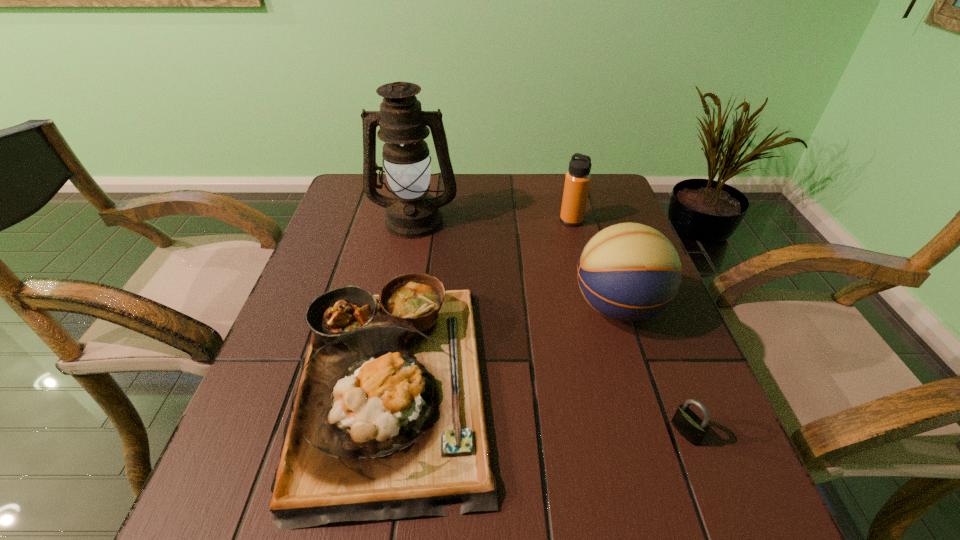
This screenshot has height=540, width=960. I want to click on blank area located on the right of the platter, so click(662, 382).

I want to click on free space located 0.270m on the back of the padlock, so click(638, 306).

I want to click on oil lamp that is at the far edge, so 412,213.

Locate an element on the screen. This screenshot has height=540, width=960. thermos bottle positioned at the far edge is located at coordinates (577, 181).

You are a GUI agent. You are given a task and a screenshot of the screen. Output one action in this format:
    pyautogui.click(x=<x>, y=<y>)
    Task: Click on the object at the near edge
    
    Given the screenshot: What is the action you would take?
    tap(388, 421)

The width and height of the screenshot is (960, 540). In order to click on oil lamp at the left edge in this screenshot , I will do `click(412, 213)`.

Find the location of a particular element. The width and height of the screenshot is (960, 540). platter that is at the left edge is located at coordinates (388, 421).

At what (x,y) coordinates should I click in order to perform the action: click on basketball present at the right edge. Please return your answer as a coordinate pair (x, y). Image resolution: width=960 pixels, height=540 pixels. Looking at the image, I should click on (628, 272).

Identify the location of thermos bottle that is at the right edge. Image resolution: width=960 pixels, height=540 pixels. (577, 181).

The image size is (960, 540). What are the coordinates of `padlock that is at the right edge` in the screenshot? It's located at (687, 423).